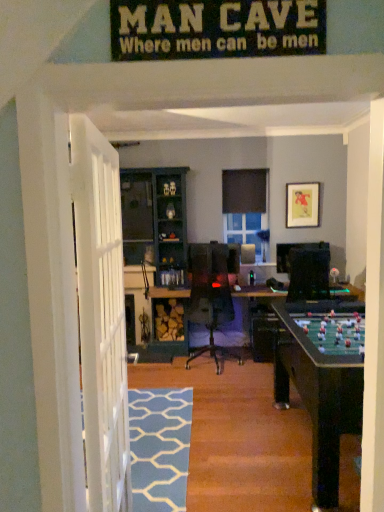
This screenshot has width=384, height=512. What do you see at coordinates (159, 447) in the screenshot?
I see `blue textured rug at lower center` at bounding box center [159, 447].

This screenshot has height=512, width=384. I want to click on matte paper picture frame at upper right, so click(302, 205).

Based on the photo, measure the distance between matte paper picture frame at upper right and camera.

matte paper picture frame at upper right is 5.64 meters away from camera.

What are the coordinates of `green felt table at center` in the screenshot? It's located at (318, 385).

Is point (286, 191) closer or farther from the camera than point (301, 373)?

Point (286, 191) is positioned farther from the camera compared to point (301, 373).

Can we say matte paper picture frame at upper right lies outside green felt table at center?

matte paper picture frame at upper right lies outside green felt table at center's area.

Are matte paper picture frame at upper right and green felt table at center located far from each other?

Yes.

Is matte paper picture frame at upper right wider or thinner than green felt table at center?

Answer: Considering their sizes, matte paper picture frame at upper right looks slimmer than green felt table at center.

Which is further, [305,218] or [140,170]?

The point [305,218] is behind.

How far apart are matte paper picture frame at upper right and blue painted wood cabinet at center?

They are 5.72 feet apart.

Consider the image. Considering the sizes of objects matte paper picture frame at upper right and blue painted wood cabinet at center in the image provided, who is taller, matte paper picture frame at upper right or blue painted wood cabinet at center?

blue painted wood cabinet at center is taller.

Is matte paper picture frame at upper right touching blue painted wood cabinet at center?

No, matte paper picture frame at upper right is not next to blue painted wood cabinet at center.

I want to click on table in front of the blue painted wood cabinet at center, so click(318, 385).

Is point (170, 267) closer or farther from the camera than point (307, 345)?

Point (170, 267) appears to be farther away from the viewer than point (307, 345).

Can you tell me how much blue painted wood cabinet at center and green felt table at center differ in facing direction?

0.332 degrees separate the facing orientations of blue painted wood cabinet at center and green felt table at center.

From the image's perspective, is blue painted wood cabinet at center positioned above or below green felt table at center?

blue painted wood cabinet at center is situated higher than green felt table at center in the image.

Which of these two, blue textured rug at lower center or green felt table at center, is bigger?

Bigger between the two is green felt table at center.

Is blue textured rug at lower center oriented towards green felt table at center?

No, blue textured rug at lower center is not oriented towards green felt table at center.

Who is shorter, blue textured rug at lower center or green felt table at center?

green felt table at center.

What's the angular difference between blue textured rug at lower center and green felt table at center's facing directions?

blue textured rug at lower center and green felt table at center are facing 0.497 degrees away from each other.

From a real-world perspective, is blue painted wood cabinet at center on blue textured rug at lower center?

Yes, from a real-world perspective, blue painted wood cabinet at center is above blue textured rug at lower center.

Does blue painted wood cabinet at center appear on the right side of blue textured rug at lower center?

Incorrect, blue painted wood cabinet at center is not on the right side of blue textured rug at lower center.

Is point (172, 230) more distant than point (166, 433)?

Yes, point (172, 230) is behind point (166, 433).

Image resolution: width=384 pixels, height=512 pixels. I want to click on doormat in front of the matte paper picture frame at upper right, so click(x=159, y=447).

From the image's perspective, between blue textured rug at lower center and matte paper picture frame at upper right, which one is located above?

matte paper picture frame at upper right is shown above in the image.

Considering the sizes of objects blue textured rug at lower center and matte paper picture frame at upper right in the image provided, who is bigger, blue textured rug at lower center or matte paper picture frame at upper right?

With larger size is blue textured rug at lower center.

Would you say blue textured rug at lower center is to the left or to the right of matte paper picture frame at upper right in the picture?

From the image, it's evident that blue textured rug at lower center is to the left of matte paper picture frame at upper right.

Is blue textured rug at lower center in contact with blue painted wood cabinet at center?

They are not placed beside each other.

Does blue textured rug at lower center have a greater width compared to blue painted wood cabinet at center?

Indeed, blue textured rug at lower center has a greater width compared to blue painted wood cabinet at center.

Is point (151, 463) behind point (160, 218)?

No, it is in front of (160, 218).

Does blue textured rug at lower center appear on the right side of blue painted wood cabinet at center?

Yes.

The image size is (384, 512). I want to click on table on the left of the matte paper picture frame at upper right, so click(318, 385).

Find the location of `picture frame above the blue painted wood cabinet at center (from the image's perspective)`. picture frame above the blue painted wood cabinet at center (from the image's perspective) is located at coordinates (302, 205).

Which object lies nearer to the anchor point blue textured rug at lower center, matte paper picture frame at upper right or blue painted wood cabinet at center?

The object closer to blue textured rug at lower center is blue painted wood cabinet at center.

Estimate the real-world distances between objects in this image. Which object is further from matte paper picture frame at upper right, green felt table at center or blue painted wood cabinet at center?

Based on the image, green felt table at center appears to be further to matte paper picture frame at upper right.

Considering their positions, is blue textured rug at lower center positioned closer to matte paper picture frame at upper right than blue painted wood cabinet at center?

Among the two, blue painted wood cabinet at center is located nearer to matte paper picture frame at upper right.

Which object lies nearer to the anchor point blue painted wood cabinet at center, blue textured rug at lower center or matte paper picture frame at upper right?

Based on the image, matte paper picture frame at upper right appears to be nearer to blue painted wood cabinet at center.

Estimate the real-world distances between objects in this image. Which object is further from blue textured rug at lower center, matte paper picture frame at upper right or green felt table at center?

Based on the image, matte paper picture frame at upper right appears to be further to blue textured rug at lower center.

Which object lies nearer to the anchor point matte paper picture frame at upper right, green felt table at center or blue textured rug at lower center?

green felt table at center.

Estimate the real-world distances between objects in this image. Which object is further from blue textured rug at lower center, blue painted wood cabinet at center or green felt table at center?

The object further to blue textured rug at lower center is blue painted wood cabinet at center.

Which object lies nearer to the anchor point green felt table at center, blue textured rug at lower center or matte paper picture frame at upper right?

blue textured rug at lower center lies closer to green felt table at center than the other object.

Identify the location of table located between blue textured rug at lower center and matte paper picture frame at upper right in the depth direction. The height and width of the screenshot is (512, 384). (318, 385).

Locate an element on the screen. cabinetry located between blue textured rug at lower center and matte paper picture frame at upper right in the depth direction is located at coordinates (156, 221).

Find the location of a particular element. This screenshot has width=384, height=512. cabinetry located between green felt table at center and matte paper picture frame at upper right in the depth direction is located at coordinates (156, 221).

Where is `table located between blue textured rug at lower center and blue painted wood cabinet at center in the depth direction`? table located between blue textured rug at lower center and blue painted wood cabinet at center in the depth direction is located at coordinates (318, 385).